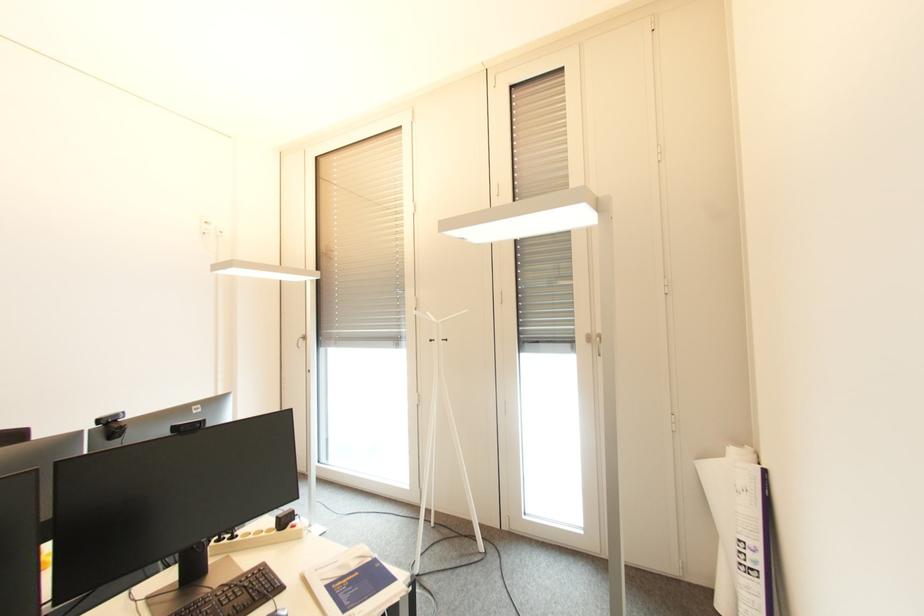
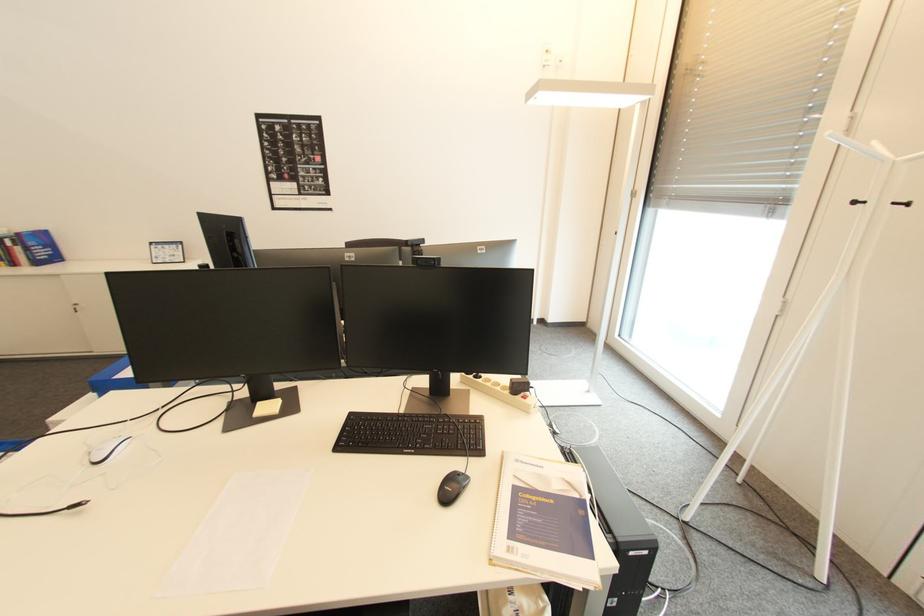
How did the camera likely rotate?

The rotation direction of the camera is left-down.